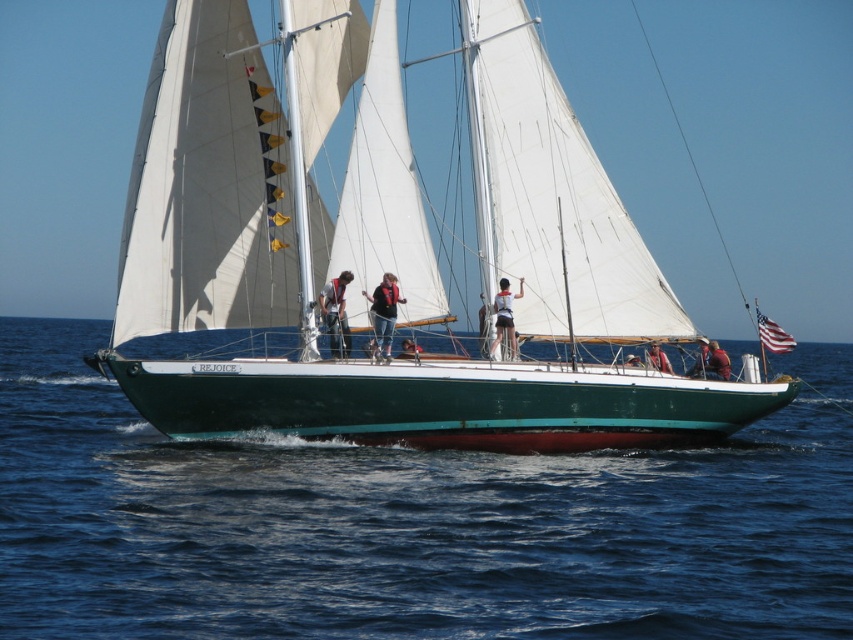
You are a passenger on the sailboat named REJOICE. You notice the blue water at center and the tan leather jacket at center. Which object is higher from the deck of the boat?

The blue water at center has a greater height compared to the tan leather jacket at center, so the blue water at center is higher from the deck of the boat.

You are a photographer on a nearby boat and want to take a photo of the two people wearing the matte gray pants at center and tan leather jacket at center. The minimum distance for your camera to focus clearly is 15 meters. Will your camera be able to focus on both subjects clearly?

The distance between the matte gray pants at center and tan leather jacket at center is 17.58 meters. Since the minimum focusing distance of your camera is 15 meters, your camera can focus on both subjects clearly as they are beyond the minimum required distance.